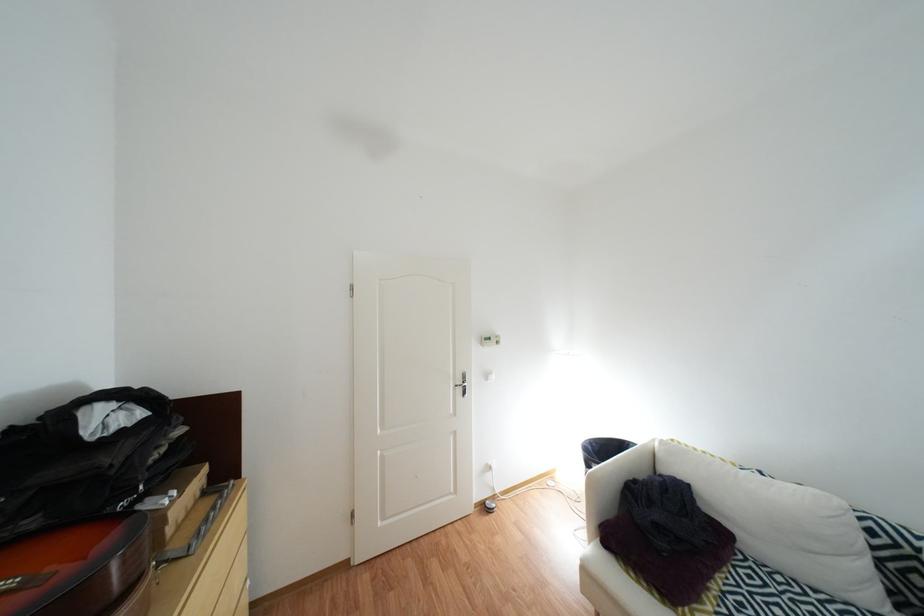
I want to click on white light switch, so click(490, 339).